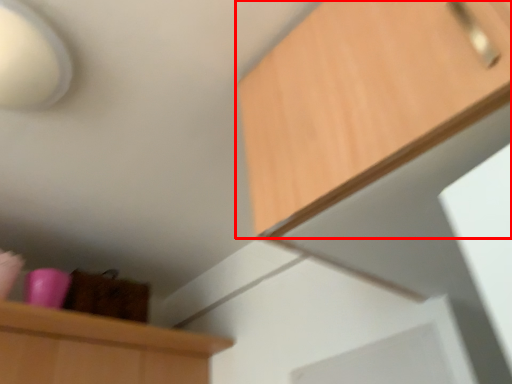
Question: From the image, what is the correct spatial relationship of cabinetry (annotated by the red box) in relation to lamp?

Choices:
 (A) right
 (B) left

Answer: (A)